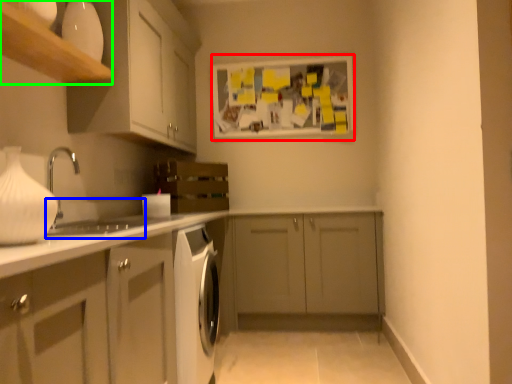
Question: Considering the real-world distances, which object is closest to bulletin board (highlighted by a red box)? sink (highlighted by a blue box) or shelf (highlighted by a green box).

Choices:
 (A) sink
 (B) shelf

Answer: (A)